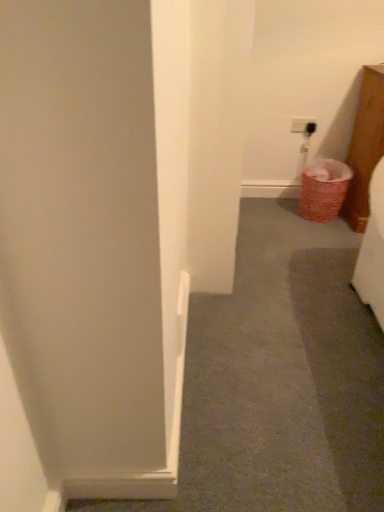
Image resolution: width=384 pixels, height=512 pixels. I want to click on vacant space situated above white smooth door at center (from a real-world perspective), so click(275, 311).